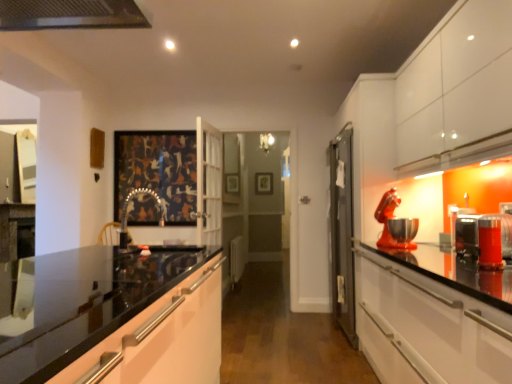
Question: Is translucent orange glass at right, which is counted as the 1th appliance, starting from the front, bigger than metallic red stand mixer at right, the 1th appliance from the back?

Choices:
 (A) no
 (B) yes

Answer: (A)

Question: From a real-world perspective, is translucent orange glass at right, which is counted as the 1th appliance, starting from the front, beneath metallic red stand mixer at right, which is the fourth appliance in front-to-back order?

Choices:
 (A) no
 (B) yes

Answer: (B)

Question: Does translucent orange glass at right, positioned as the 4th appliance in back-to-front order, have a lesser height compared to metallic red stand mixer at right, which is the fourth appliance in front-to-back order?

Choices:
 (A) no
 (B) yes

Answer: (B)

Question: Is translucent orange glass at right, which is counted as the 1th appliance, starting from the front, aimed at metallic red stand mixer at right, the 1th appliance from the back?

Choices:
 (A) yes
 (B) no

Answer: (B)

Question: Is translucent orange glass at right, positioned as the 4th appliance in back-to-front order, facing away from metallic red stand mixer at right, the 1th appliance from the back?

Choices:
 (A) yes
 (B) no

Answer: (B)

Question: Does translucent orange glass at right, positioned as the 4th appliance in back-to-front order, have a lesser width compared to metallic red stand mixer at right, which is the fourth appliance in front-to-back order?

Choices:
 (A) no
 (B) yes

Answer: (B)

Question: From a real-world perspective, is metallic silver toaster at right, which is counted as the 2th appliance, starting from the back, on top of glossy black countertop at center?

Choices:
 (A) yes
 (B) no

Answer: (A)

Question: Considering the relative sizes of metallic silver toaster at right, which is counted as the 2th appliance, starting from the back, and glossy black countertop at center in the image provided, is metallic silver toaster at right, which is counted as the 2th appliance, starting from the back, wider than glossy black countertop at center?

Choices:
 (A) no
 (B) yes

Answer: (A)

Question: Considering the relative sizes of metallic silver toaster at right, the 3th appliance in the front-to-back sequence, and glossy black countertop at center in the image provided, is metallic silver toaster at right, the 3th appliance in the front-to-back sequence, bigger than glossy black countertop at center?

Choices:
 (A) no
 (B) yes

Answer: (A)

Question: From the image's perspective, is metallic silver toaster at right, the 3th appliance in the front-to-back sequence, above glossy black countertop at center?

Choices:
 (A) no
 (B) yes

Answer: (B)

Question: Would you consider metallic silver toaster at right, which is counted as the 2th appliance, starting from the back, to be distant from glossy black countertop at center?

Choices:
 (A) yes
 (B) no

Answer: (A)

Question: From a real-world perspective, is metallic silver toaster at right, the 3th appliance in the front-to-back sequence, positioned under glossy black countertop at center based on gravity?

Choices:
 (A) no
 (B) yes

Answer: (A)

Question: Does metallic red stand mixer at right, which is the fourth appliance in front-to-back order, have a lesser width compared to wooden picture frame at center, the 1th picture frame in the back-to-front sequence?

Choices:
 (A) no
 (B) yes

Answer: (A)